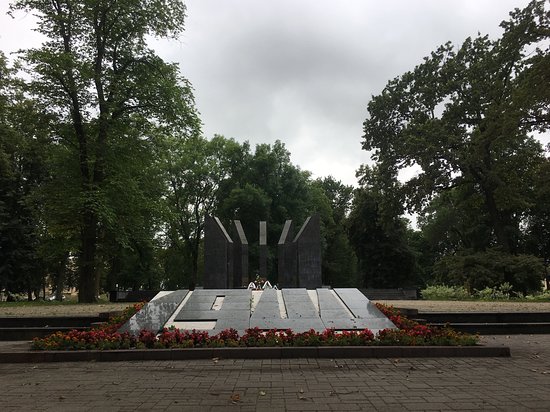
Find the location of a particular element. pillars is located at coordinates (309, 270).